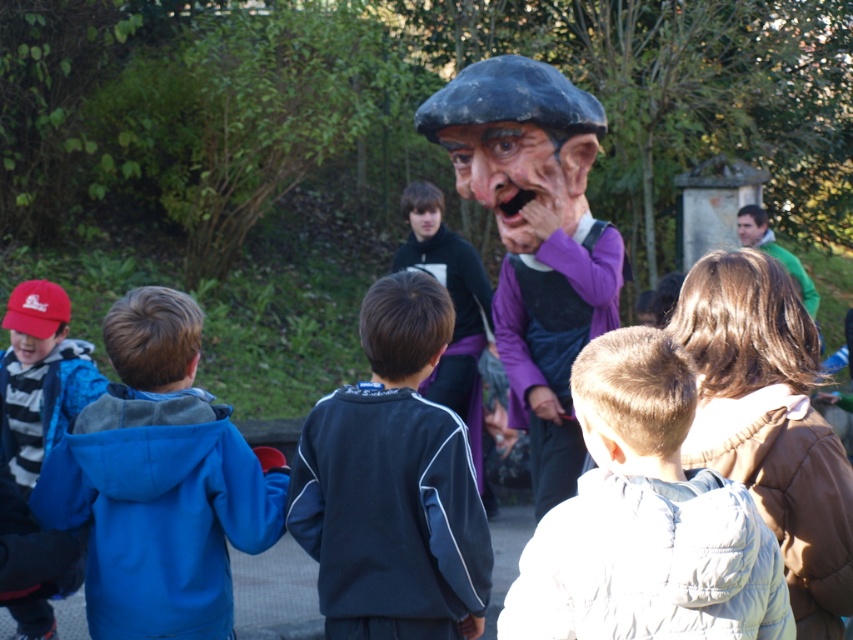
Question: Which of the following is the farthest from the observer?

Choices:
 (A) green fabric shirt at upper right
 (B) blue fleece jacket at left

Answer: (A)

Question: Can you confirm if matte purple costume at center is positioned to the right of smooth skin face at center?

Choices:
 (A) yes
 (B) no

Answer: (A)

Question: Which object is positioned closest to the smooth skin face at upper right?

Choices:
 (A) blue fleece jacket at left
 (B) matte purple costume at center
 (C) matte purple mask at center

Answer: (C)

Question: Can you confirm if white puffy jacket at lower right is positioned to the right of smooth skin face at upper right?

Choices:
 (A) no
 (B) yes

Answer: (A)

Question: Which object is closer to the camera taking this photo?

Choices:
 (A) smooth skin face at upper right
 (B) white puffy jacket at lower right

Answer: (B)

Question: Does matte purple costume at center appear over smooth skin face at center?

Choices:
 (A) yes
 (B) no

Answer: (B)